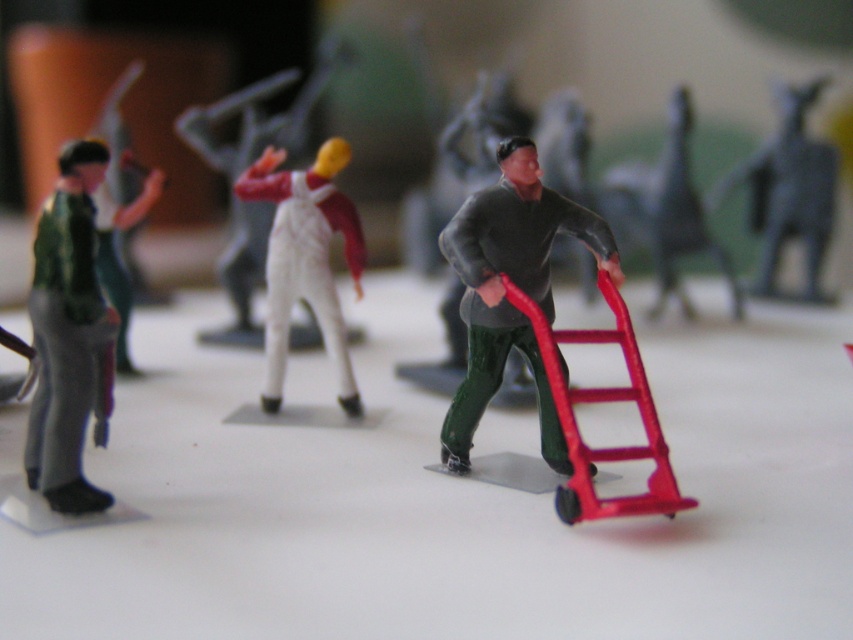
Does point (488, 204) come behind point (271, 154)?

No.

Can you confirm if green matte figure at center is positioned to the left of white matte figure at center?

No, green matte figure at center is not to the left of white matte figure at center.

Is point (509, 182) positioned in front of point (292, 228)?

Yes, point (509, 182) is in front of point (292, 228).

At what (x,y) coordinates should I click in order to perform the action: click on green matte figure at center. Please return your answer as a coordinate pair (x, y). Looking at the image, I should click on (503, 289).

Image resolution: width=853 pixels, height=640 pixels. Describe the element at coordinates (305, 259) in the screenshot. I see `white matte figure at center` at that location.

Is point (350, 212) positioned in front of point (209, 106)?

Yes, it is.

At what (x,y) coordinates should I click in order to perform the action: click on white matte figure at center. Please return your answer as a coordinate pair (x, y). The height and width of the screenshot is (640, 853). Looking at the image, I should click on (305, 259).

Locate an element on the screen. The image size is (853, 640). white matte figure at center is located at coordinates (305, 259).

From the picture: Does white plastic figure at center appear under smooth gray cat at upper right?

No.

Does white plastic figure at center appear on the right side of smooth gray cat at upper right?

No, white plastic figure at center is not to the right of smooth gray cat at upper right.

Does point (236, 300) come behind point (775, 173)?

No.

Identify the location of white plastic figure at center. (259, 115).